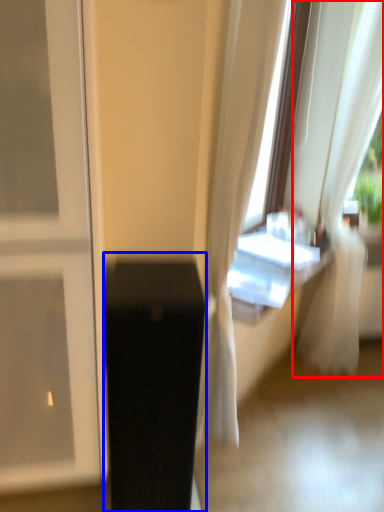
Question: Which object appears closest to the camera in this image, curtain (highlighted by a red box) or furniture (highlighted by a blue box)?

Choices:
 (A) curtain
 (B) furniture

Answer: (B)